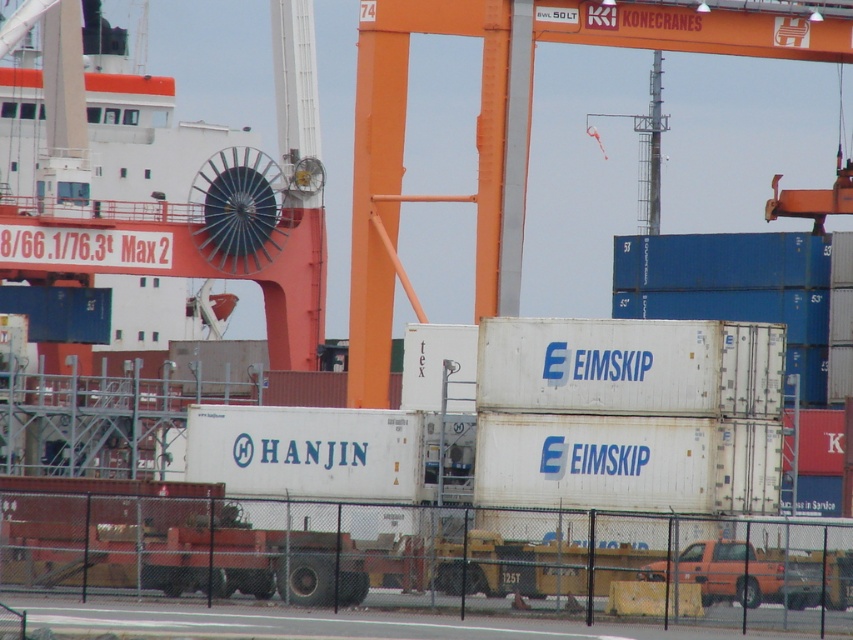
You are standing at the port and want to take a photo of the orange metallic crane at center. If your camera has a maximum focus range of 350 feet, will you be able to capture the crane clearly?

The orange metallic crane at center is 362.55 feet away from the camera, which exceeds the maximum focus range of 350 feet. Therefore, the crane will not be captured clearly.

You are a port worker who needs to position a new container near the orange metallic crane at center. Based on the coordinates provided, can you determine if the crane is positioned closer to the left or right side of the port area?

The orange metallic crane at center is located at coordinates point (506,129), which places it closer to the left side of the port area since the x coordinate is 0.202, which is less than 0.5.